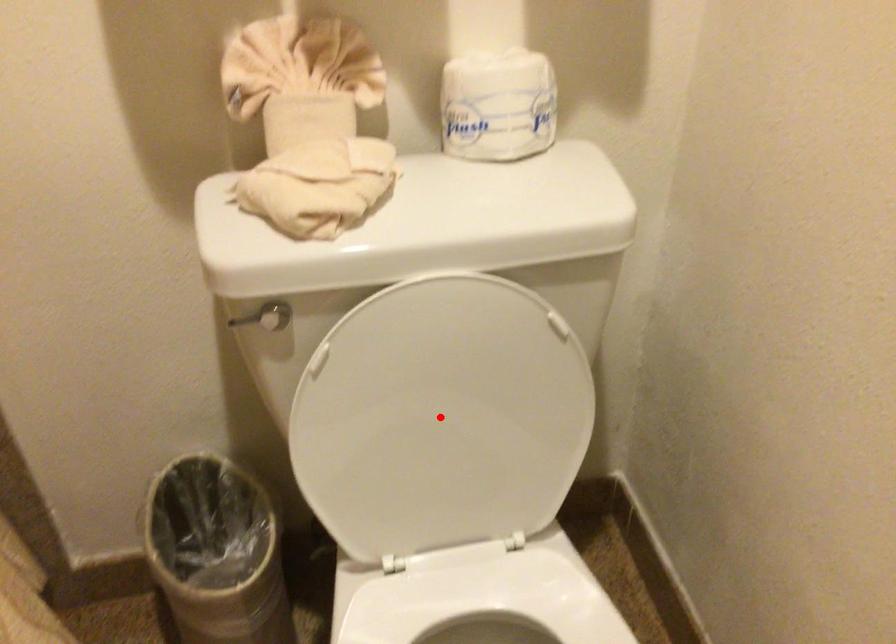
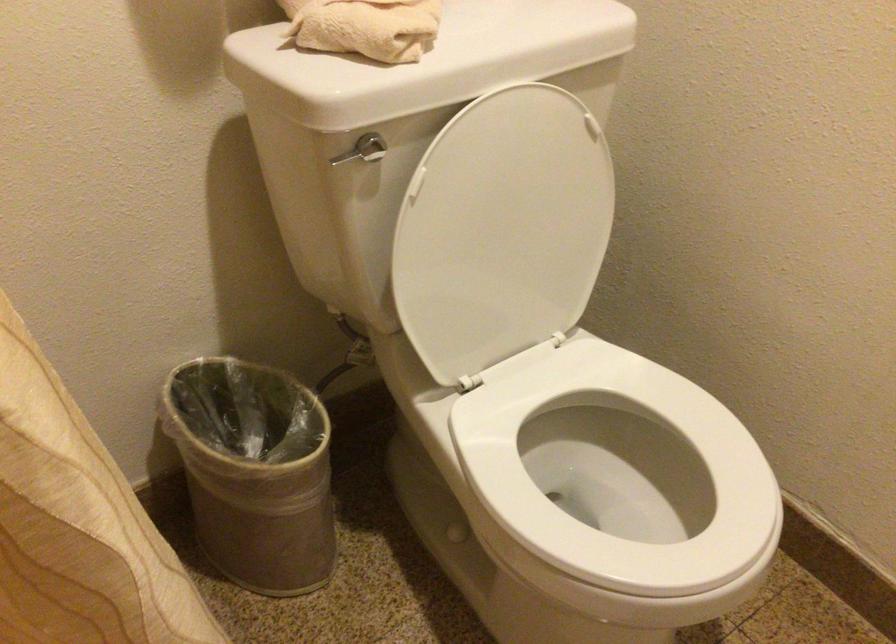
The point at the highlighted location is marked in the first image. Where is the corresponding point in the second image?

(502, 230)